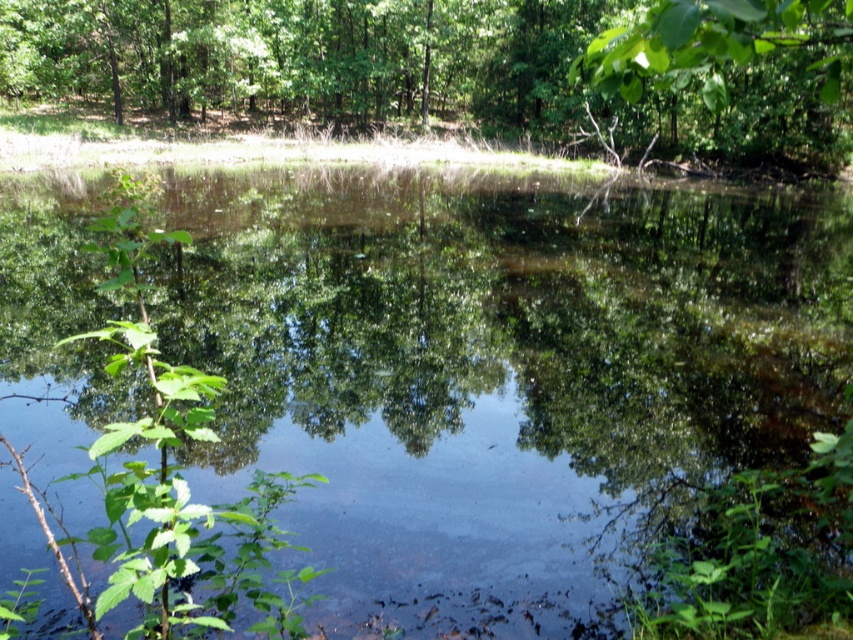
You are a photographer trying to capture the reflection of the two green leafy trees in the water. Given that the reflection of the green leafy tree at upper center is wider than the green leafy tree at upper right, which tree will have a broader reflection in the water?

The green leafy tree at upper center will have a broader reflection in the water because its width is larger than the green leafy tree at upper right.

You are standing at the edge of the water and want to throw a pebble to hit the base of the green leafy tree at upper right. The transparent water at center is 7.04 meters away from the tree. If your maximum throwing distance is 6 meters, will you be able to reach the tree?

The transparent water at center is 7.04 meters away from the green leafy tree at upper right. Since your maximum throwing distance is 6 meters, you cannot reach the tree as the distance is greater than your capability.